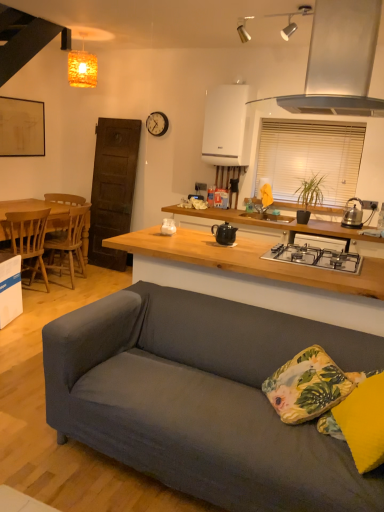
Question: From a real-world perspective, is matte yellow pillow at lower right, the 2th pillow viewed from the back, located beneath floral fabric pillow at lower right, which is the first pillow from back to front?

Choices:
 (A) yes
 (B) no

Answer: (B)

Question: From the image's perspective, is matte yellow pillow at lower right, the 2th pillow viewed from the back, on floral fabric pillow at lower right, which is the first pillow from back to front?

Choices:
 (A) yes
 (B) no

Answer: (B)

Question: Considering the relative sizes of matte yellow pillow at lower right, the first pillow from the front, and floral fabric pillow at lower right, which is the first pillow from back to front, in the image provided, is matte yellow pillow at lower right, the first pillow from the front, bigger than floral fabric pillow at lower right, which is the first pillow from back to front,?

Choices:
 (A) no
 (B) yes

Answer: (B)

Question: Are matte yellow pillow at lower right, the 2th pillow viewed from the back, and floral fabric pillow at lower right, which is the second pillow in front-to-back order, beside each other?

Choices:
 (A) no
 (B) yes

Answer: (A)

Question: Is floral fabric pillow at lower right, which is the first pillow from back to front, located within matte yellow pillow at lower right, the first pillow from the front?

Choices:
 (A) no
 (B) yes

Answer: (A)

Question: From the image's perspective, relative to satin silver range hood at upper right, is black matte gas stove at center above or below?

Choices:
 (A) below
 (B) above

Answer: (A)

Question: Is black matte gas stove at center inside or outside of satin silver range hood at upper right?

Choices:
 (A) outside
 (B) inside

Answer: (A)

Question: Considering the relative positions of black matte gas stove at center and satin silver range hood at upper right in the image provided, is black matte gas stove at center to the left or to the right of satin silver range hood at upper right?

Choices:
 (A) right
 (B) left

Answer: (B)

Question: Considering the positions of point (342, 250) and point (322, 10), is point (342, 250) closer or farther from the camera than point (322, 10)?

Choices:
 (A) closer
 (B) farther

Answer: (B)

Question: Is orange textured cube at upper center taller or shorter than wooden table at left?

Choices:
 (A) tall
 (B) short

Answer: (B)

Question: Choose the correct answer: Is orange textured cube at upper center inside wooden table at left or outside it?

Choices:
 (A) outside
 (B) inside

Answer: (A)

Question: Is orange textured cube at upper center bigger or smaller than wooden table at left?

Choices:
 (A) big
 (B) small

Answer: (B)

Question: Considering the relative positions of orange textured cube at upper center and wooden table at left in the image provided, is orange textured cube at upper center to the left or to the right of wooden table at left?

Choices:
 (A) left
 (B) right

Answer: (B)

Question: From a real-world perspective, is black matte gas stove at center positioned above or below white blinds at upper right?

Choices:
 (A) below
 (B) above

Answer: (A)

Question: Considering their positions, is black matte gas stove at center located in front of or behind white blinds at upper right?

Choices:
 (A) front
 (B) behind

Answer: (A)